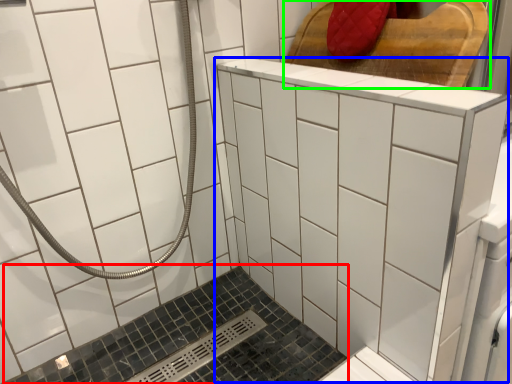
Question: Which object is the farthest from bath (highlighted by a red box)? Choose among these: ceramic tile (highlighted by a blue box) or furniture (highlighted by a green box).

Choices:
 (A) ceramic tile
 (B) furniture

Answer: (B)